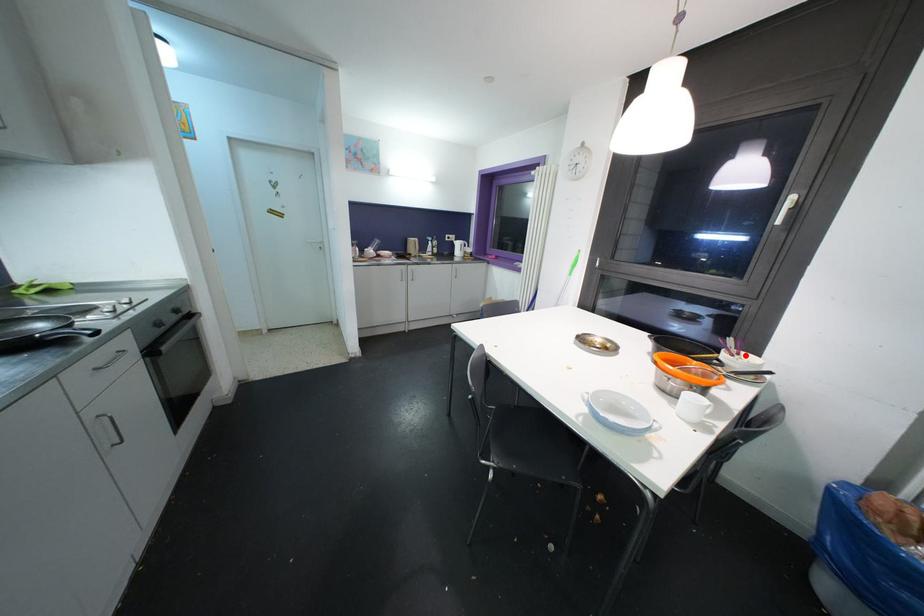
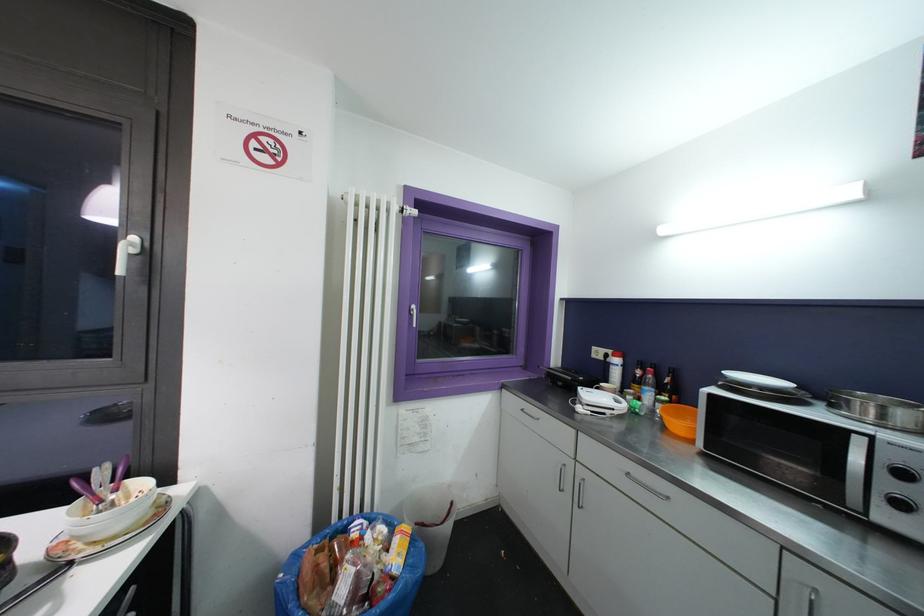
Question: I am providing you with two images of the same scene from different viewpoints. A red point is marked on the first image. At the location where the point appears in image 1, is it still visible in image 2?

Choices:
 (A) Yes
 (B) No

Answer: (A)